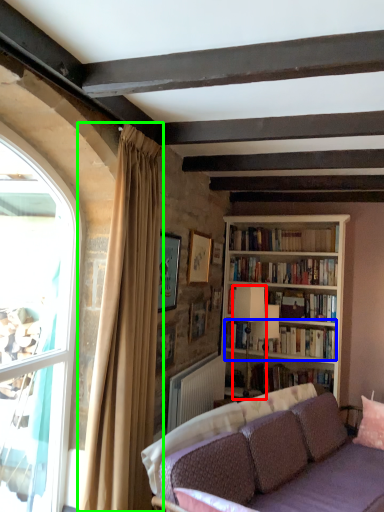
Question: Which object is the farthest from lamp (highlighted by a red box)? Choose among these: book (highlighted by a blue box) or curtain (highlighted by a green box).

Choices:
 (A) book
 (B) curtain

Answer: (B)